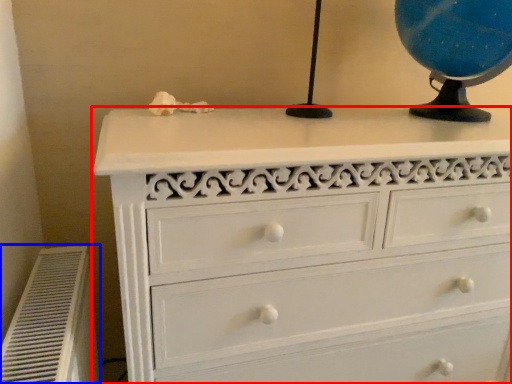
Question: Among these objects, which one is farthest to the camera, chest of drawers (highlighted by a red box) or air conditioner (highlighted by a blue box)?

Choices:
 (A) chest of drawers
 (B) air conditioner

Answer: (A)